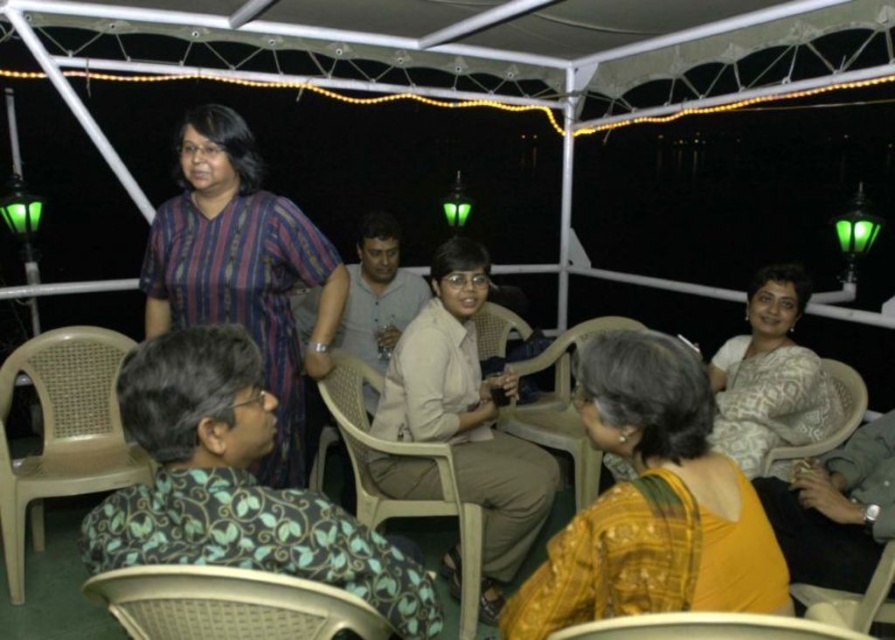
Does beige fabric pants at center have a lesser width compared to beige woven plastic chair at lower left?

Incorrect, beige fabric pants at center's width is not less than beige woven plastic chair at lower left's.

Which is above, beige fabric pants at center or beige woven plastic chair at lower left?

beige fabric pants at center is higher up.

Locate an element on the screen. beige fabric pants at center is located at coordinates 467,417.

Which is above, light beige fabric shirt at center or beige plastic chair at lower center?

Positioned higher is light beige fabric shirt at center.

Between light beige fabric shirt at center and beige plastic chair at lower center, which one has more height?

light beige fabric shirt at center

The height and width of the screenshot is (640, 895). I want to click on light beige fabric shirt at center, so pyautogui.click(x=377, y=292).

Where is `light beige fabric shirt at center`? The height and width of the screenshot is (640, 895). light beige fabric shirt at center is located at coordinates (377, 292).

Consider the image. Does light beige plastic chair at lower center appear on the right side of beige plastic chair at lower center?

Incorrect, light beige plastic chair at lower center is not on the right side of beige plastic chair at lower center.

Which of these two, light beige plastic chair at lower center or beige plastic chair at lower center, stands taller?

With more height is beige plastic chair at lower center.

Image resolution: width=895 pixels, height=640 pixels. In order to click on light beige plastic chair at lower center in this screenshot , I will do `click(229, 604)`.